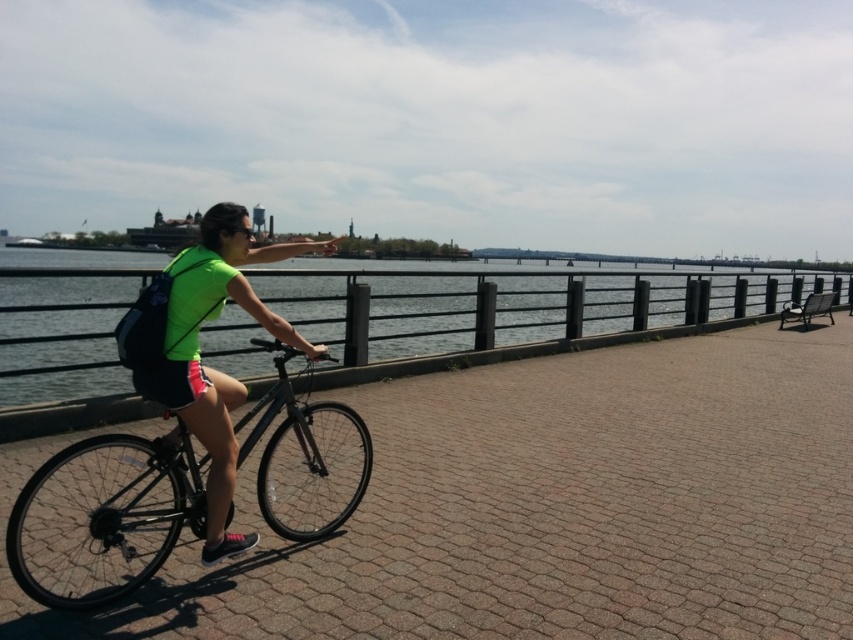
You are a photographer aiming to capture the clear water at center and the shiny black bicycle at center in a single shot. Which object should you focus on first if you want to ensure both are in sharp focus?

The clear water at center is much taller than the shiny black bicycle at center, so you should focus on the clear water at center first to ensure depth of field covers both objects.

You are standing at the point labeled as point (276, 440) on the path. You want to throw a pebble to the water body beyond the railing. The pebble can travel 4 meters. Will it reach the water?

The distance between you and the water body is 3.65 meters, so yes, the pebble can reach the water as it is within the 4 meters range.